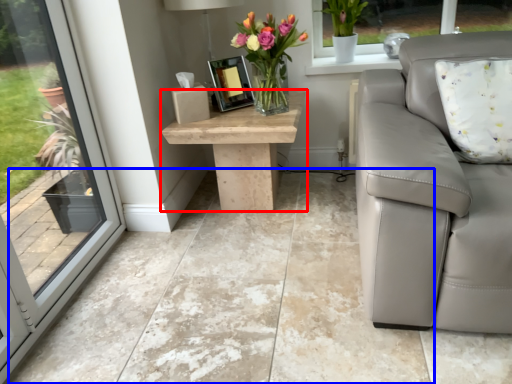
Question: Which object appears farthest to the camera in this image, table (highlighted by a red box) or concrete (highlighted by a blue box)?

Choices:
 (A) table
 (B) concrete

Answer: (A)